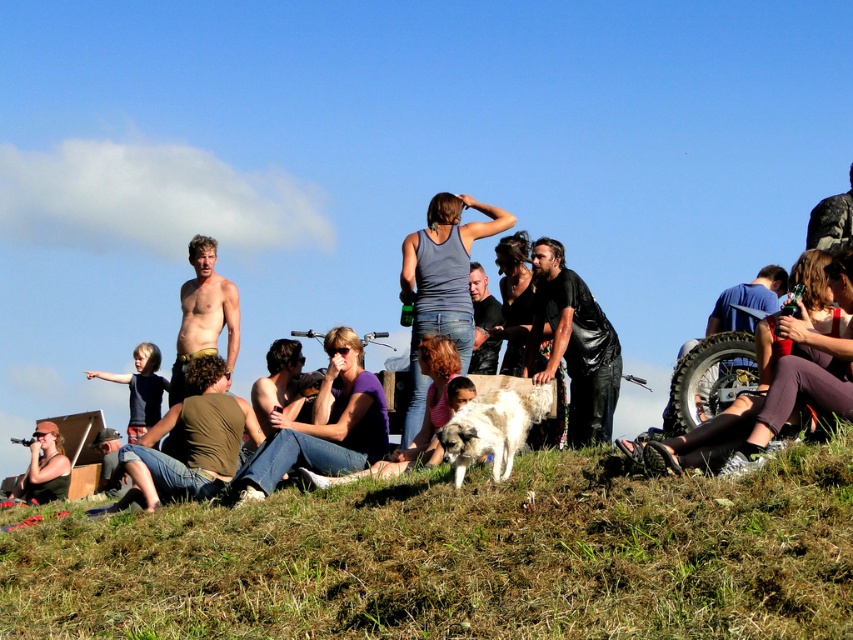
You are a photographer trying to capture a closeup of the black leather jacket at center. The camera you are using has a focal length of 50mm. Based on the coordinates provided, can you determine if the jacket is within the camera frame? The camera frame is defined as the area between coordinates 0.5 and 0.6 in the x and y axes respectively.

The black leather jacket at center is located at coordinates point (573,344). The camera frame is between 0.5 and 0.6 on both axes. Since the y coordinate 0.674 exceeds the upper limit of 0.6, the jacket is slightly outside the camera frame.

You are a photographer trying to capture a candid shot of the shiny skin torso at center without including the green cotton shirt at lower left in the frame. Is it possible to do so based on their positions?

The green cotton shirt at lower left is closer to the viewer than the shiny skin torso at center. Since the green cotton shirt is in front, it would block the view of the shiny skin torso at center, making it impossible to capture the torso without including the shirt in the frame.

You are a photographer trying to capture a candid shot of the shiny skin torso at center without including the black leather jacket at center in the frame. Is this possible given their positions?

The black leather jacket at center is located above the shiny skin torso at center, so it would block the view. Therefore, it is not possible to capture the shiny skin torso at center without including the black leather jacket at center in the frame.